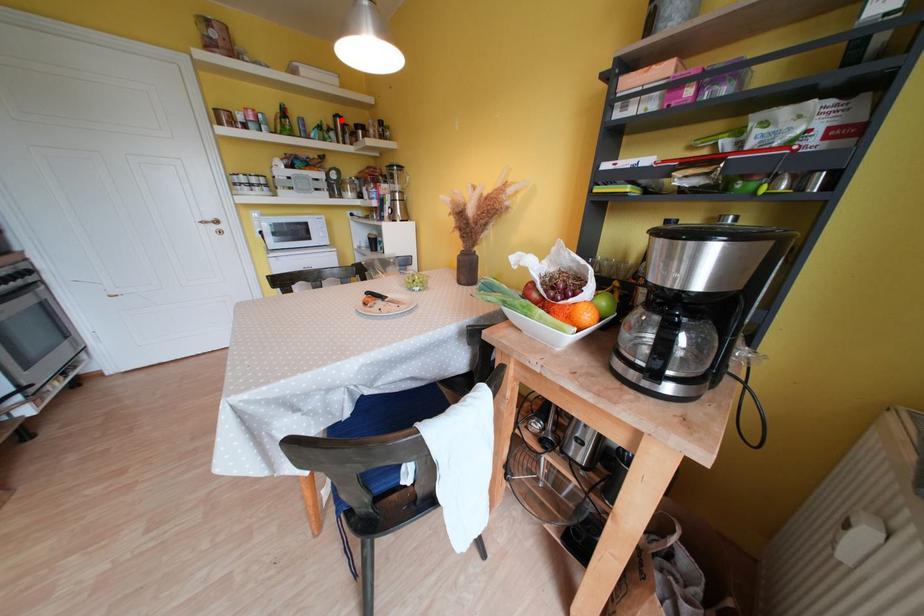
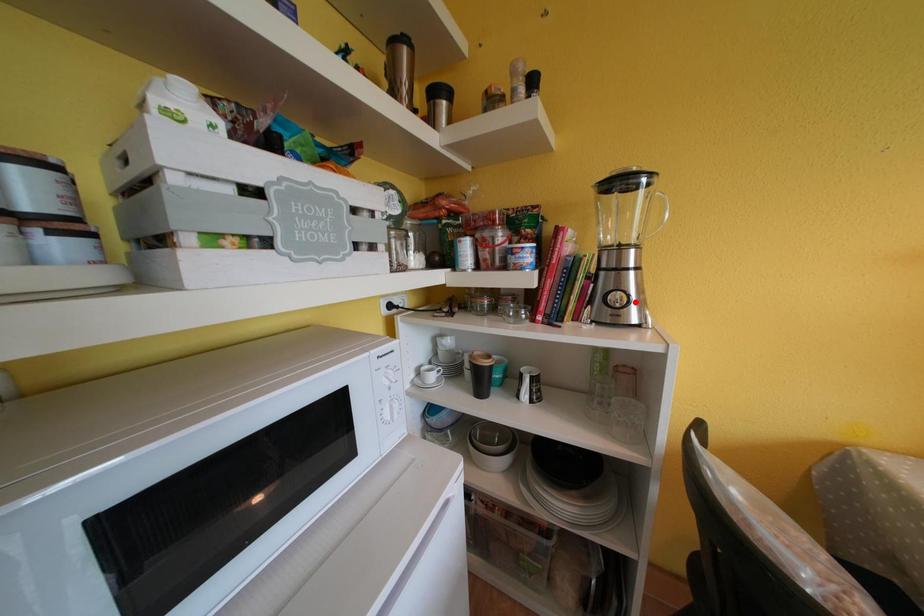
I am providing you with two images of the same scene from different viewpoints. A red point is marked on the first image and another point is marked on the second image. Is the marked point in image1 the same physical position as the marked point in image2?

No